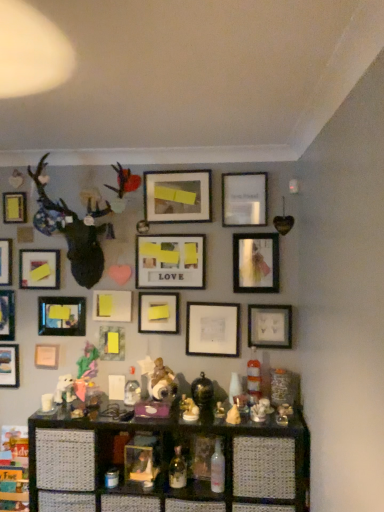
Question: From a real-world perspective, relative to matte wooden picture frame at center, the eleventh picture frame from the left, is matte white picture frame at lower right, placed as the 15th picture frame when sorted from left to right, vertically above or below?

Choices:
 (A) above
 (B) below

Answer: (B)

Question: From the image's perspective, is matte white picture frame at lower right, the first picture frame positioned from the right, above or below matte wooden picture frame at center, the eleventh picture frame from the left?

Choices:
 (A) below
 (B) above

Answer: (A)

Question: Based on their relative distances, which object is farther from the matte black picture frame at lower left, the thirteenth picture frame from the right?

Choices:
 (A) matte yellow picture frame at upper left, acting as the fourth picture frame starting from the left
 (B) shiny gold figurine at center, positioned as the first toy in left-to-right order
 (C) matte black picture frame at upper center, the third picture frame positioned from the right
 (D) matte white picture frame at lower right, the first picture frame positioned from the right
 (E) yellow matte picture frame at upper left, which ranks as the 5th picture frame in left-to-right order

Answer: (C)

Question: Which is farther from the white porcelain figurine at center, marked as the second toy in a right-to-left arrangement?

Choices:
 (A) matte wooden picture frame at center, the eleventh picture frame from the left
 (B) shiny gold figurine at center, positioned as the 3th toy in right-to-left order
 (C) translucent glass bottle at center
 (D) matte black picture frame at upper right, the second picture frame in the right-to-left sequence
 (E) matte black picture frame at lower left, the third picture frame positioned from the left

Answer: (E)